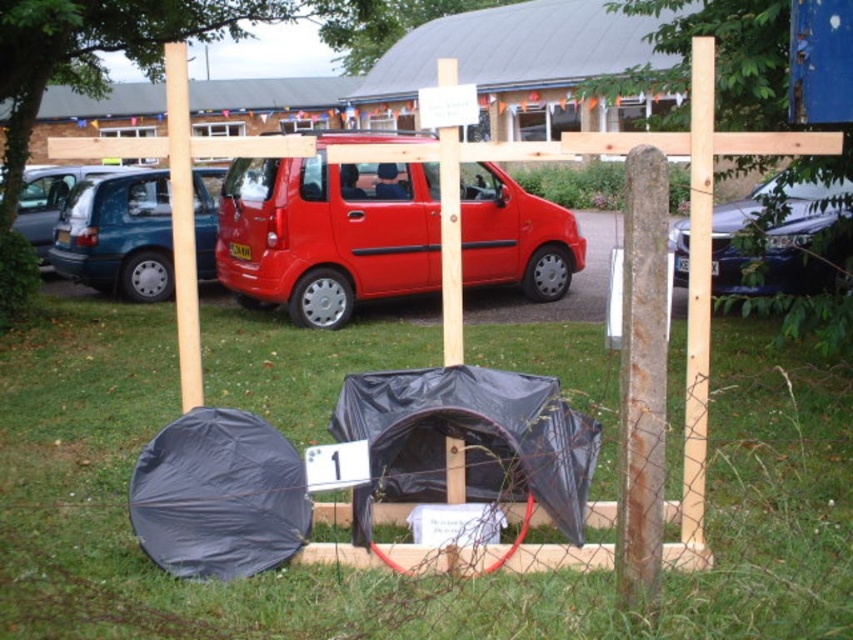
Question: Can you confirm if matte blue minivan at left is bigger than light brown wooden post at right?

Choices:
 (A) yes
 (B) no

Answer: (A)

Question: Among these points, which one is nearest to the camera?

Choices:
 (A) (28, 182)
 (B) (685, 380)
 (C) (132, 237)
 (D) (836, 257)

Answer: (B)

Question: Is the position of shiny black car at right less distant than that of light brown wooden post at right?

Choices:
 (A) no
 (B) yes

Answer: (A)

Question: Estimate the real-world distances between objects in this image. Which object is farther from the light brown wooden post at right?

Choices:
 (A) metallic blue van at left
 (B) brown wooden pole at left
 (C) shiny black car at right
 (D) green grass at center

Answer: (A)

Question: Does black tarpaulin tent at center appear under light brown wooden post at right?

Choices:
 (A) no
 (B) yes

Answer: (B)

Question: Estimate the real-world distances between objects in this image. Which object is closer to the light brown wooden post at right?

Choices:
 (A) green grass at center
 (B) matte blue minivan at left

Answer: (A)